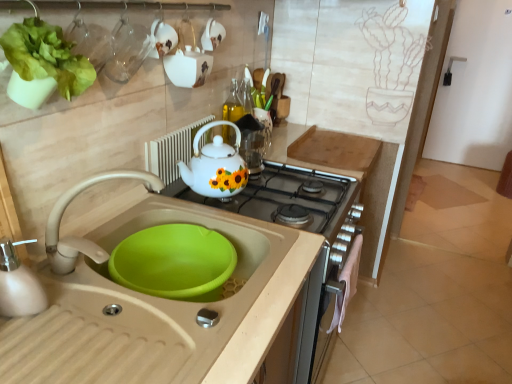
You are a GUI agent. You are given a task and a screenshot of the screen. Output one action in this format:
    pyautogui.click(x=<x>, y=<y>)
    Task: Click on the empty space that is ontop of beige plastic sink at lower left (from a real-world perspective)
    
    Given the screenshot: What is the action you would take?
    pyautogui.click(x=118, y=306)